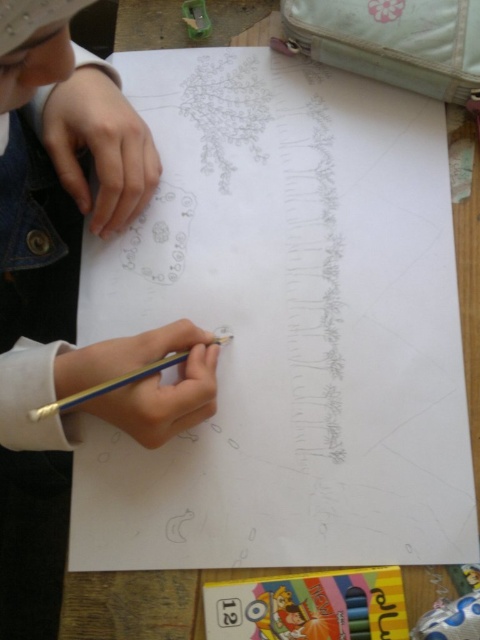
Question: Which point appears farthest from the camera in this image?

Choices:
 (A) (43, 406)
 (B) (205, 515)

Answer: (B)

Question: Is pencil sketch paper at center thinner than metallic blue pencil at lower center?

Choices:
 (A) no
 (B) yes

Answer: (A)

Question: Is pencil sketch paper at center smaller than metallic blue pencil at lower center?

Choices:
 (A) no
 (B) yes

Answer: (A)

Question: Which of the following is the closest to the observer?

Choices:
 (A) metallic blue pencil at lower center
 (B) pencil sketch paper at center

Answer: (A)

Question: Is pencil sketch paper at center above metallic blue pencil at lower center?

Choices:
 (A) yes
 (B) no

Answer: (A)